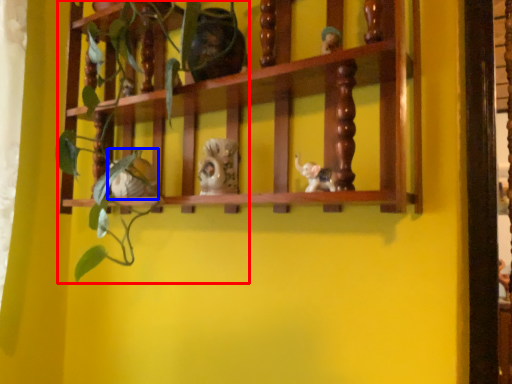
Question: Which object is closer to the camera taking this photo, plant (highlighted by a red box) or toy (highlighted by a blue box)?

Choices:
 (A) plant
 (B) toy

Answer: (A)